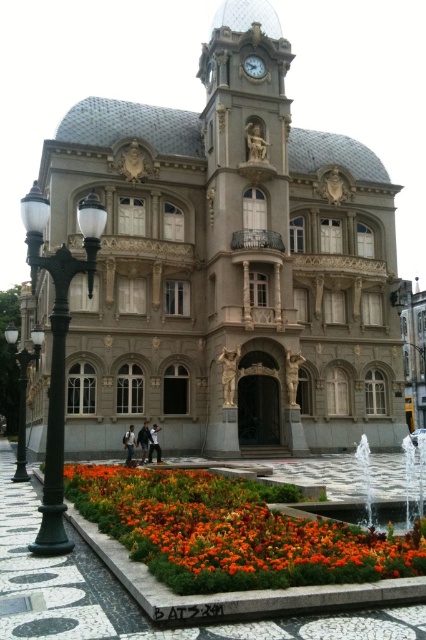
Can you confirm if matte gray palace at center is shorter than green polished metal streetlamp at left?

In fact, matte gray palace at center may be taller than green polished metal streetlamp at left.

Which is below, matte gray palace at center or green polished metal streetlamp at left?

green polished metal streetlamp at left

What do you see at coordinates (229, 266) in the screenshot?
I see `matte gray palace at center` at bounding box center [229, 266].

The height and width of the screenshot is (640, 426). I want to click on matte gray palace at center, so click(229, 266).

Is point (81, 228) positioned in front of point (13, 353)?

Yes, point (81, 228) is closer to viewer.

Between point (51, 490) and point (5, 337), which one is positioned behind?

The point (5, 337) is more distant.

Find the location of a particular element. green polished metal streetlamp at left is located at coordinates (57, 346).

Locate an element on the screen. Image resolution: width=426 pixels, height=640 pixels. green polished metal streetlamp at left is located at coordinates (57, 346).

Is matte gray palace at center to the left of black metal lamp post at left from the viewer's perspective?

In fact, matte gray palace at center is to the right of black metal lamp post at left.

Between point (267, 381) and point (22, 422), which one is positioned behind?

Positioned behind is point (267, 381).

What are the coordinates of `matte gray palace at center` in the screenshot? It's located at pyautogui.click(x=229, y=266).